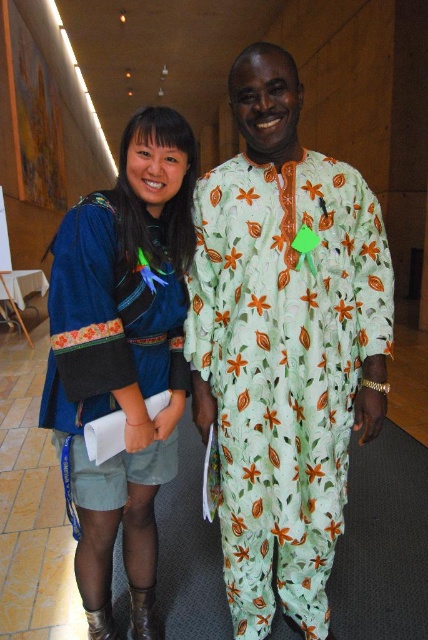
Question: Is green floral fabric at center positioned at the back of velvet blue dress at center?

Choices:
 (A) yes
 (B) no

Answer: (A)

Question: Which point is closer to the camera?

Choices:
 (A) (267, 502)
 (B) (118, 262)

Answer: (B)

Question: Can you confirm if green floral fabric at center is wider than velvet blue dress at center?

Choices:
 (A) no
 (B) yes

Answer: (B)

Question: Which of the following is the closest to the observer?

Choices:
 (A) velvet blue dress at center
 (B) green floral fabric at center

Answer: (A)

Question: Does green floral fabric at center appear on the right side of velvet blue dress at center?

Choices:
 (A) yes
 (B) no

Answer: (A)